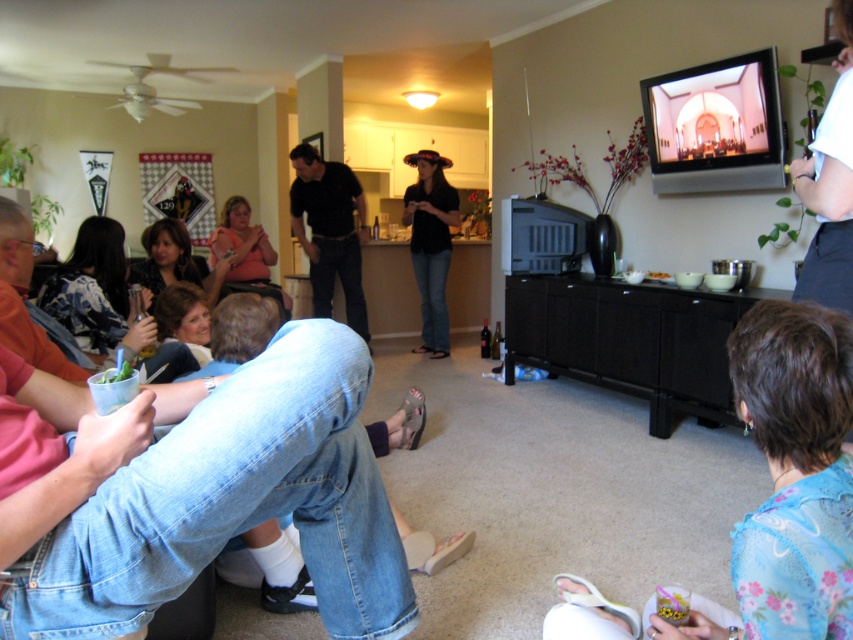
Question: Which point is closer to the camera?

Choices:
 (A) blue floral shirt at lower right
 (B) matte pink shirt at center

Answer: (A)

Question: Which point appears closest to the camera in this image?

Choices:
 (A) (440, 323)
 (B) (764, 330)
 (C) (262, 284)

Answer: (B)

Question: Is floral blouse at lower left wider than black matte hat at center?

Choices:
 (A) yes
 (B) no

Answer: (A)

Question: Which is farther from the floral blouse at lower left?

Choices:
 (A) blue floral shirt at lower right
 (B) black matte shirt at center
 (C) matte pink shirt at center
 (D) black matte hat at center

Answer: (D)

Question: Is floral blouse at lower left wider than black matte hat at center?

Choices:
 (A) no
 (B) yes

Answer: (B)

Question: Does floral blouse at lower left have a smaller size compared to black matte hat at center?

Choices:
 (A) yes
 (B) no

Answer: (B)